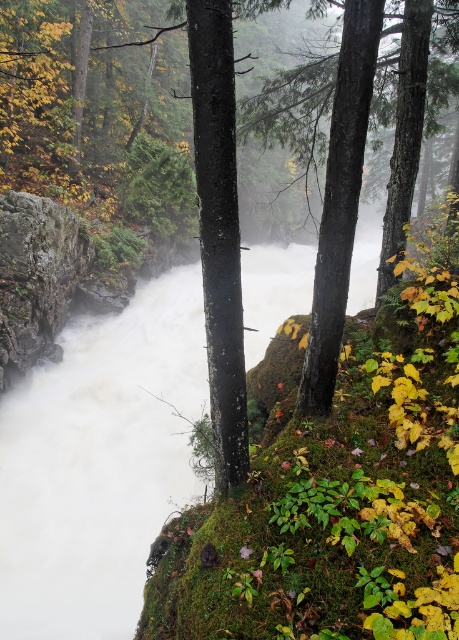
Question: Is smooth black tree trunk at center below green rough bark tree at center?

Choices:
 (A) yes
 (B) no

Answer: (A)

Question: Does smooth black tree trunk at center lie in front of green rough bark tree at center?

Choices:
 (A) yes
 (B) no

Answer: (A)

Question: Estimate the real-world distances between objects in this image. Which object is farther from the smooth black tree trunk at center?

Choices:
 (A) green rough bark tree at center
 (B) smooth bark tree at center

Answer: (A)

Question: Can you confirm if smooth bark tree at center is positioned above green rough bark tree at center?

Choices:
 (A) no
 (B) yes

Answer: (A)

Question: Which point appears closest to the camera in this image?

Choices:
 (A) (313, 284)
 (B) (203, 161)

Answer: (B)

Question: Which object is the farthest from the green rough bark tree at center?

Choices:
 (A) smooth black tree trunk at center
 (B) smooth bark tree at center

Answer: (A)